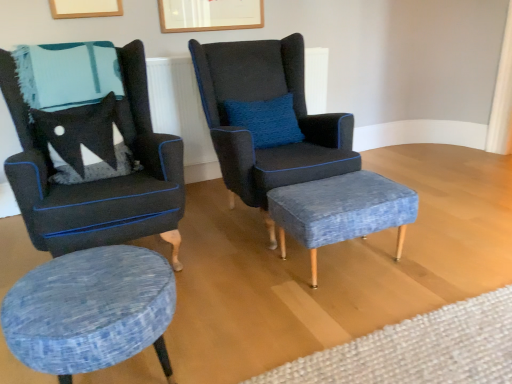
Question: Choose the correct answer: Is blue textured ottoman at center, the second plain from the back, inside white textured rug at lower right, marked as the 1th plain in a back-to-front arrangement, or outside it?

Choices:
 (A) inside
 (B) outside

Answer: (B)

Question: Considering their positions, is blue textured ottoman at center, the second plain from the back, located in front of or behind white textured rug at lower right, the 2th plain positioned from the front?

Choices:
 (A) front
 (B) behind

Answer: (A)

Question: Which object is the farthest from the blue textured ottoman at center, the second plain from the back?

Choices:
 (A) blue fabric stool at center, marked as the 2th stool in a left-to-right arrangement
 (B) velvet dark blue armchair at center, placed as the 1th chair when sorted from right to left
 (C) textured blue fabric wingback chair at left, acting as the second chair starting from the right
 (D) textured blue fabric stool at lower left, arranged as the 2th stool when viewed from the back
 (E) white textured rug at lower right, the 2th plain positioned from the front

Answer: (C)

Question: Estimate the real-world distances between objects in this image. Which object is farther from the velvet dark blue armchair at center, placed as the 1th chair when sorted from right to left?

Choices:
 (A) white textured rug at lower right, the 2th plain positioned from the front
 (B) textured blue fabric stool at lower left, placed as the 1th stool when sorted from front to back
 (C) textured blue fabric wingback chair at left, acting as the second chair starting from the right
 (D) blue textured ottoman at center, the second plain from the back
 (E) blue fabric stool at center, marked as the 2th stool in a left-to-right arrangement

Answer: (A)